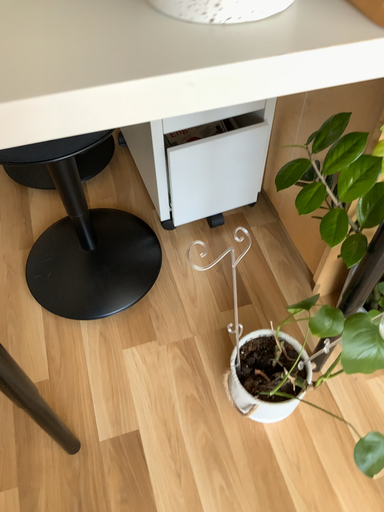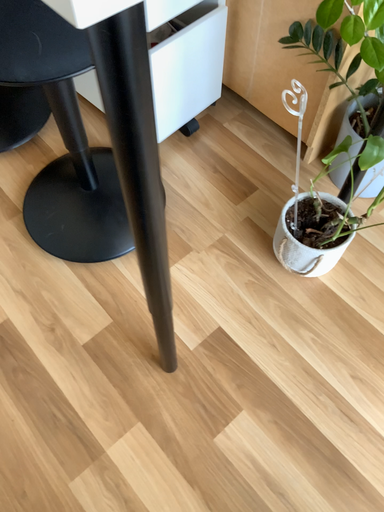
Question: Which way did the camera rotate in the video?

Choices:
 (A) rotated left
 (B) rotated right

Answer: (B)